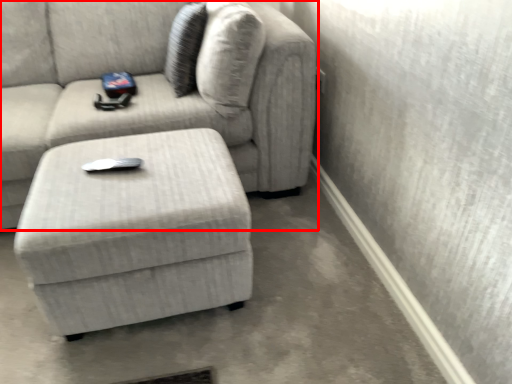
Question: Where is studio couch (annotated by the red box) located in relation to table in the image?

Choices:
 (A) left
 (B) right

Answer: (A)